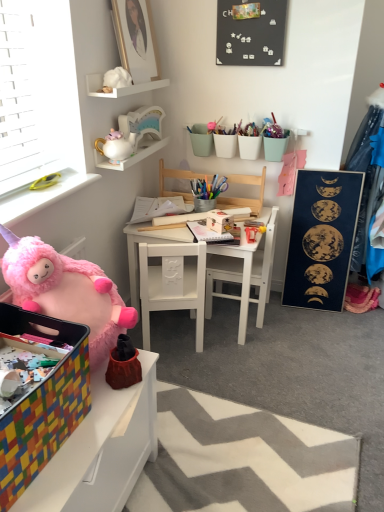
Measure the distance between point (112, 459) and camera.

They are 1.05 meters apart.

The height and width of the screenshot is (512, 384). What do you see at coordinates (101, 449) in the screenshot?
I see `multicolored plastic storage bin at lower left, which ranks as the second table in back-to-front order` at bounding box center [101, 449].

Where is `white matte chair at center, the 2th chair positioned from the bottom`? The image size is (384, 512). white matte chair at center, the 2th chair positioned from the bottom is located at coordinates (244, 270).

Describe the element at coordinates (120, 88) in the screenshot. The width and height of the screenshot is (384, 512). I see `white matte shelf at upper center, placed as the first shelf when sorted from top to bottom` at that location.

Measure the distance between white ceramic teapot at upper left, the 2th shelf in the top-to-bottom sequence, and camera.

white ceramic teapot at upper left, the 2th shelf in the top-to-bottom sequence, is 1.68 meters from camera.

The image size is (384, 512). I want to click on multicolored plastic storage bin at lower left, which is counted as the first table, starting from the front, so click(101, 449).

Do you think white ceramic teapot at upper left, acting as the 1th shelf starting from the bottom, is within white matte table at center, which is counted as the second table, starting from the front, or outside of it?

white ceramic teapot at upper left, acting as the 1th shelf starting from the bottom, cannot be found inside white matte table at center, which is counted as the second table, starting from the front.

Is white ceramic teapot at upper left, acting as the 1th shelf starting from the bottom, next to white matte table at center, which is counted as the second table, starting from the front?

No, white ceramic teapot at upper left, acting as the 1th shelf starting from the bottom, is not with white matte table at center, which is counted as the second table, starting from the front.

Looking at their sizes, would you say white ceramic teapot at upper left, the 2th shelf in the top-to-bottom sequence, is wider or thinner than white matte table at center, the 1th table from the back?

white ceramic teapot at upper left, the 2th shelf in the top-to-bottom sequence, is thinner than white matte table at center, the 1th table from the back.

Who is taller, multicolored plastic box at lower left or white matte chair at center, which is the second chair in top-to-bottom order?

With more height is white matte chair at center, which is the second chair in top-to-bottom order.

Is multicolored plastic box at lower left not near white matte chair at center, the 2th chair positioned from the bottom?

Yes, multicolored plastic box at lower left and white matte chair at center, the 2th chair positioned from the bottom, are quite far apart.

Identify the location of box located on the left of white matte chair at center, the 2th chair positioned from the bottom. The height and width of the screenshot is (512, 384). (42, 406).

Is multicolored plastic box at lower left looking in the opposite direction of white matte chair at center, the 2th chair positioned from the bottom?

That's not correct — multicolored plastic box at lower left is not looking away from white matte chair at center, the 2th chair positioned from the bottom.

Who is more distant, wooden chair at center, acting as the first chair starting from the top, or fluffy pink plush at lower left, which appears as the 1th toy when viewed from the front?

wooden chair at center, acting as the first chair starting from the top, is behind.

From a real-world perspective, is wooden chair at center, acting as the first chair starting from the top, physically above fluffy pink plush at lower left, which ranks as the first toy in bottom-to-top order?

Actually, wooden chair at center, acting as the first chair starting from the top, is physically below fluffy pink plush at lower left, which ranks as the first toy in bottom-to-top order, in the real world.

Looking at this image, between wooden chair at center, acting as the first chair starting from the top, and fluffy pink plush at lower left, which appears as the 1th toy when viewed from the front, which one appears on the left side from the viewer's perspective?

From the viewer's perspective, fluffy pink plush at lower left, which appears as the 1th toy when viewed from the front, appears more on the left side.

How much distance is there between wooden chair at center, which appears as the third chair when ordered from the bottom, and fluffy pink plush at lower left, positioned as the third toy in top-to-bottom order?

wooden chair at center, which appears as the third chair when ordered from the bottom, and fluffy pink plush at lower left, positioned as the third toy in top-to-bottom order, are 3.42 feet apart.

Can you confirm if white matte table at center, the 1th table positioned from the top, is wider than gold-framed portrait at upper left?

Correct, the width of white matte table at center, the 1th table positioned from the top, exceeds that of gold-framed portrait at upper left.

Between white matte table at center, the 2th table when ordered from bottom to top, and gold-framed portrait at upper left, which one has less height?

With less height is gold-framed portrait at upper left.

Based on the photo, from the image's perspective, who appears lower, white matte table at center, the 1th table positioned from the top, or gold-framed portrait at upper left?

white matte table at center, the 1th table positioned from the top, is shown below in the image.

From the image's perspective, does white ceramic teapot at upper left, the 2th shelf in the top-to-bottom sequence, appear higher than white fabric doll at upper center, arranged as the third toy when ordered from the bottom?

Actually, white ceramic teapot at upper left, the 2th shelf in the top-to-bottom sequence, appears below white fabric doll at upper center, arranged as the third toy when ordered from the bottom, in the image.

From a real-world perspective, is white ceramic teapot at upper left, acting as the 1th shelf starting from the bottom, positioned over white fabric doll at upper center, arranged as the third toy when ordered from the bottom, based on gravity?

No, from a real-world perspective, white ceramic teapot at upper left, acting as the 1th shelf starting from the bottom, is not above white fabric doll at upper center, arranged as the third toy when ordered from the bottom.

Where is `the 1st shelf to the right of the white fabric doll at upper center, arranged as the second toy when viewed from the back, starting your count from the anchor`? the 1st shelf to the right of the white fabric doll at upper center, arranged as the second toy when viewed from the back, starting your count from the anchor is located at coordinates (132, 154).

Are white ceramic teapot at upper left, acting as the 1th shelf starting from the bottom, and white fabric doll at upper center, arranged as the third toy when ordered from the bottom, far apart?

white ceramic teapot at upper left, acting as the 1th shelf starting from the bottom, is near white fabric doll at upper center, arranged as the third toy when ordered from the bottom, not far away.

Is white matte chair at center, which is the second chair in top-to-bottom order, thinner than wooden chair at center, which appears as the third chair when ordered from the bottom?

In fact, white matte chair at center, which is the second chair in top-to-bottom order, might be wider than wooden chair at center, which appears as the third chair when ordered from the bottom.

Does white matte chair at center, which is the second chair in top-to-bottom order, have a larger size compared to wooden chair at center, which appears as the third chair when ordered from the bottom?

Indeed, white matte chair at center, which is the second chair in top-to-bottom order, has a larger size compared to wooden chair at center, which appears as the third chair when ordered from the bottom.

Is white matte chair at center, which is the second chair in top-to-bottom order, facing towards wooden chair at center, which appears as the third chair when ordered from the bottom?

No, white matte chair at center, which is the second chair in top-to-bottom order, is not facing towards wooden chair at center, which appears as the third chair when ordered from the bottom.

From the image's perspective, is white matte chair at center, which is the second chair in top-to-bottom order, located above or below wooden chair at center, which appears as the third chair when ordered from the bottom?

white matte chair at center, which is the second chair in top-to-bottom order, is below wooden chair at center, which appears as the third chair when ordered from the bottom.

Does gold-framed portrait at upper left have a lesser height compared to white matte table at center, the 1th table positioned from the top?

Yes.

From a real-world perspective, does gold-framed portrait at upper left stand above white matte table at center, the 1th table from the back?

Indeed, from a real-world perspective, gold-framed portrait at upper left stands above white matte table at center, the 1th table from the back.

What's the angular difference between gold-framed portrait at upper left and white matte table at center, the 1th table from the back,'s facing directions?

87.6 degrees.

Considering the sizes of objects gold-framed portrait at upper left and white matte table at center, the 1th table positioned from the top, in the image provided, who is smaller, gold-framed portrait at upper left or white matte table at center, the 1th table positioned from the top,?

With smaller size is gold-framed portrait at upper left.

Where is `table that is the 1st one when counting downward from the white ceramic teapot at upper left, acting as the 1th shelf starting from the bottom (from the image's perspective)`? table that is the 1st one when counting downward from the white ceramic teapot at upper left, acting as the 1th shelf starting from the bottom (from the image's perspective) is located at coordinates (203, 274).

Find the location of a particular element. The height and width of the screenshot is (512, 384). box above the white matte chair at center, the 2th chair positioned from the bottom (from a real-world perspective) is located at coordinates (42, 406).

Which object lies further to the anchor point fluffy pink plush at lower left, which is the 3th toy from back to front, white matte chair at center, which is the second chair in top-to-bottom order, or white matte table at center, which is counted as the second table, starting from the front?

white matte chair at center, which is the second chair in top-to-bottom order, is positioned further to the anchor fluffy pink plush at lower left, which is the 3th toy from back to front.

From the picture: Based on their spatial positions, is white glossy teapot at upper center, the second toy ordered from the bottom, or white ceramic teapot at upper left, the 2th shelf in the top-to-bottom sequence, further from fluffy pink plush at lower left, positioned as the third toy in top-to-bottom order?

white glossy teapot at upper center, the second toy ordered from the bottom.

When comparing their distances from fluffy pink plush at lower left, positioned as the third toy in top-to-bottom order, does white ceramic teapot at upper left, acting as the 1th shelf starting from the bottom, or multicolored plastic box at lower left seem further?

Based on the image, white ceramic teapot at upper left, acting as the 1th shelf starting from the bottom, appears to be further to fluffy pink plush at lower left, positioned as the third toy in top-to-bottom order.

From the image, which object appears to be farther from white matte chair at center, which is the 3th chair from top to bottom, wooden chair at center, which appears as the third chair when ordered from the bottom, or black matte board at upper center, the 1th bulletin board viewed from the top?

black matte board at upper center, the 1th bulletin board viewed from the top, is further to white matte chair at center, which is the 3th chair from top to bottom.

Estimate the real-world distances between objects in this image. Which object is closer to wooden chair at center, which appears as the third chair when ordered from the bottom, white matte shelf at upper center, the 2th shelf from the bottom, or white matte chair at center, which is the 3th chair from top to bottom?

white matte chair at center, which is the 3th chair from top to bottom.

Considering their positions, is gold-framed portrait at upper left positioned further to fluffy pink plush at lower left, which ranks as the first toy in bottom-to-top order, than white matte chair at center, the 1th chair from the bottom?

gold-framed portrait at upper left is further to fluffy pink plush at lower left, which ranks as the first toy in bottom-to-top order.

Estimate the real-world distances between objects in this image. Which object is closer to black matte board at upper center, the second bulletin board viewed from the right, white matte chair at center, the 1th chair from the bottom, or white matte shelf at upper center, the 2th shelf from the bottom?

white matte shelf at upper center, the 2th shelf from the bottom, lies closer to black matte board at upper center, the second bulletin board viewed from the right, than the other object.

Which object lies further to the anchor point wooden chair at center, which appears as the third chair when ordered from the bottom, dark blue matte poster at right, marked as the second bulletin board in a left-to-right arrangement, or multicolored plastic box at lower left?

multicolored plastic box at lower left is positioned further to the anchor wooden chair at center, which appears as the third chair when ordered from the bottom.

Locate an element on the screen. Image resolution: width=384 pixels, height=512 pixels. table situated between white ceramic teapot at upper left, the 2th shelf in the top-to-bottom sequence, and dark blue matte poster at right, the 1th bulletin board ordered from the bottom, from left to right is located at coordinates (203, 274).

I want to click on table between fluffy pink plush at lower left, which appears as the 1th toy when viewed from the front, and white matte chair at center, which is the second chair in top-to-bottom order, in the front-back direction, so click(203, 274).

You are a GUI agent. You are given a task and a screenshot of the screen. Output one action in this format:
    pyautogui.click(x=<x>, y=<y>)
    Task: Click on the picture frame between black matte board at upper center, which ranks as the 2th bulletin board in bottom-to-top order, and white glossy teapot at upper center, acting as the first toy starting from the back, in the vertical direction
    Image resolution: width=384 pixels, height=512 pixels.
    Given the screenshot: What is the action you would take?
    pyautogui.click(x=136, y=39)

You are a GUI agent. You are given a task and a screenshot of the screen. Output one action in this format:
    pyautogui.click(x=<x>, y=<y>)
    Task: Click on the picture frame between black matte board at upper center, the 1th bulletin board viewed from the top, and white matte table at center, the 1th table from the back, in the up-down direction
    Image resolution: width=384 pixels, height=512 pixels.
    Given the screenshot: What is the action you would take?
    pyautogui.click(x=136, y=39)